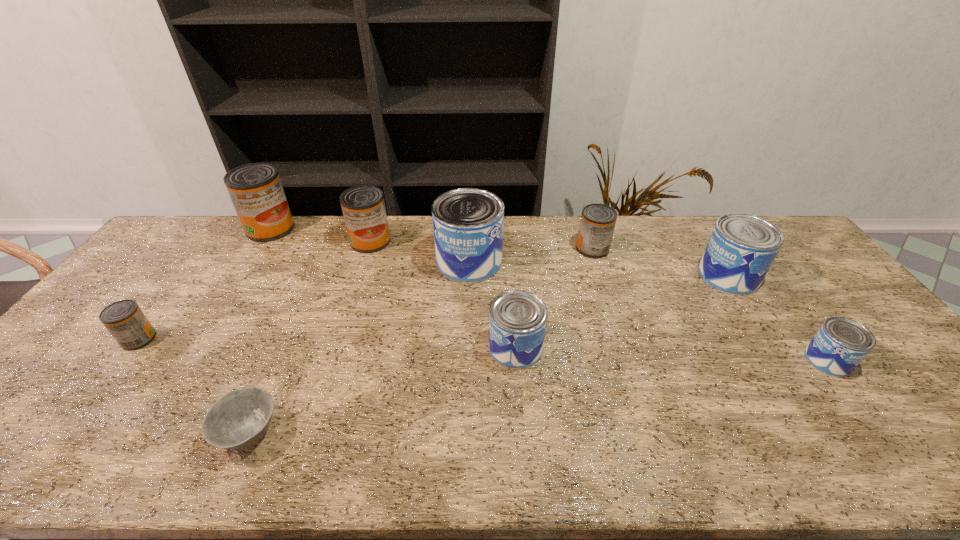
Find the location of a particular element. Image resolution: width=960 pixels, height=540 pixels. the biggest red can is located at coordinates (255, 189).

At what (x,y) coordinates should I click in order to perform the action: click on the third red can from right to left. Please return your answer as a coordinate pair (x, y). Looking at the image, I should click on (255, 189).

Locate an element on the screen. This screenshot has width=960, height=540. the biggest blue can is located at coordinates (468, 223).

Identify the location of the third smallest red can. The height and width of the screenshot is (540, 960). (363, 206).

Where is `the third red can from left to right`? This screenshot has height=540, width=960. the third red can from left to right is located at coordinates (363, 206).

I want to click on the second biggest blue can, so click(742, 247).

Locate an element on the screen. This screenshot has width=960, height=540. the rightmost red can is located at coordinates (597, 224).

What are the coordinates of `the third can from right to left` in the screenshot? It's located at (597, 224).

Image resolution: width=960 pixels, height=540 pixels. I want to click on the second smallest blue can, so click(x=517, y=318).

The width and height of the screenshot is (960, 540). Identify the location of the leftmost can. coord(124,319).